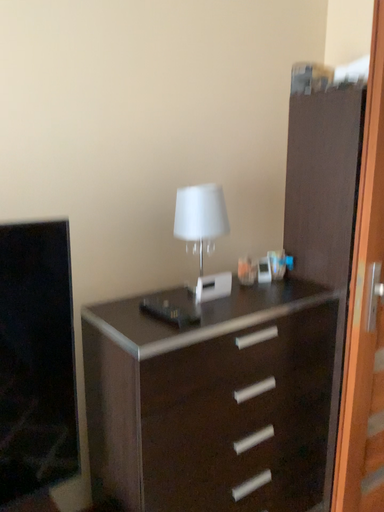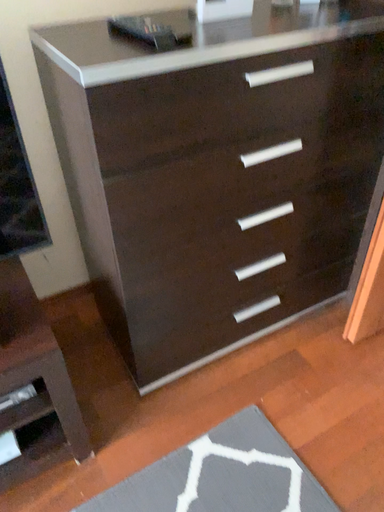
Question: How did the camera likely rotate when shooting the video?

Choices:
 (A) rotated right
 (B) rotated left

Answer: (B)